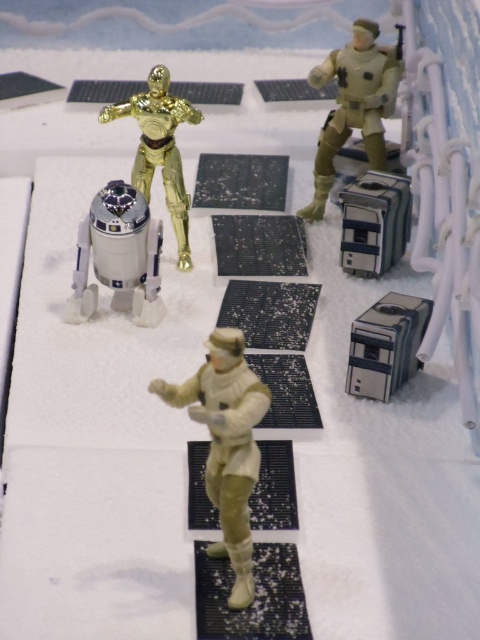
Based on the photo, is tan matte astronaut at upper right positioned in front of gold metallic figure at upper center?

No, it is behind gold metallic figure at upper center.

At what (x,y) coordinates should I click in order to perform the action: click on tan matte astronaut at upper right. Please return your answer as a coordinate pair (x, y). Looking at the image, I should click on (355, 104).

Who is more forward, [180,228] or [388,346]?

Point [388,346] is in front.

Between point (175, 170) and point (404, 353), which one is positioned behind?

The point (175, 170) is behind.

Which is behind, point (175, 124) or point (384, 385)?

Point (175, 124)

Locate an element on the screen. Image resolution: width=480 pixels, height=640 pixels. gold metallic figure at upper center is located at coordinates (159, 148).

Does light beige plastic astronaut at center have a lesser height compared to metallic silver cube at center?

No, light beige plastic astronaut at center is not shorter than metallic silver cube at center.

Who is more distant from viewer, (x=227, y=468) or (x=365, y=189)?

Point (x=365, y=189)

Is point (224, 538) farther from camera compared to point (404, 179)?

No, it is not.

Find the location of a particular element. light beige plastic astronaut at center is located at coordinates (227, 444).